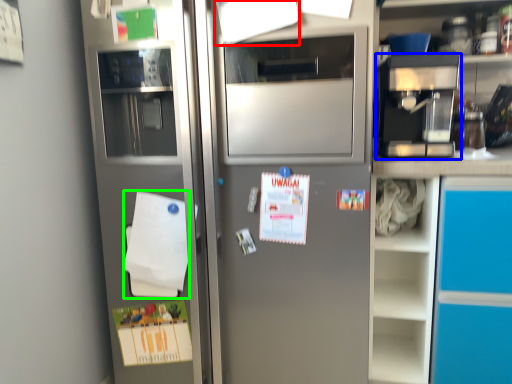
Question: Which is farther away from paper (highlighted by a red box)? coffee machine (highlighted by a blue box) or notepad (highlighted by a green box)?

Choices:
 (A) coffee machine
 (B) notepad

Answer: (B)